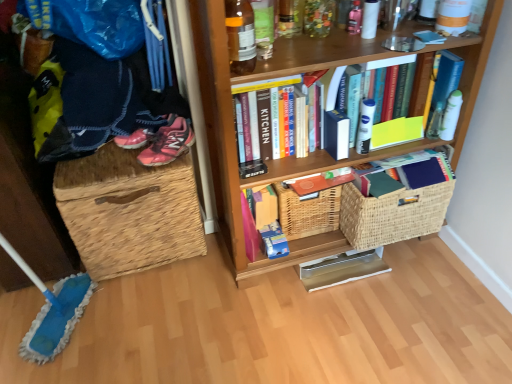
Find the location of a particular element. free space in front of wooden bookcase at right is located at coordinates (342, 330).